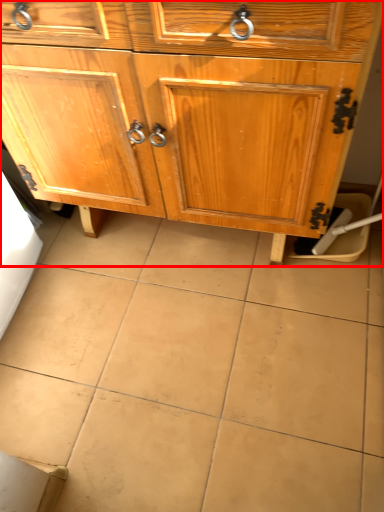
Question: From the image, what is the correct spatial relationship of chest of drawers (annotated by the red box) in relation to ceramic tile?

Choices:
 (A) right
 (B) left

Answer: (A)